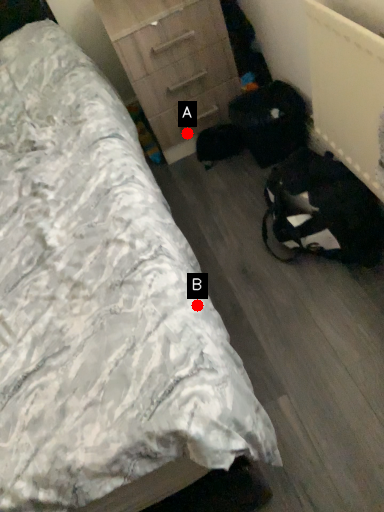
Question: Two points are circled on the image, labeled by A and B beside each circle. Which point is farther to the camera?

Choices:
 (A) A is further
 (B) B is further

Answer: (A)